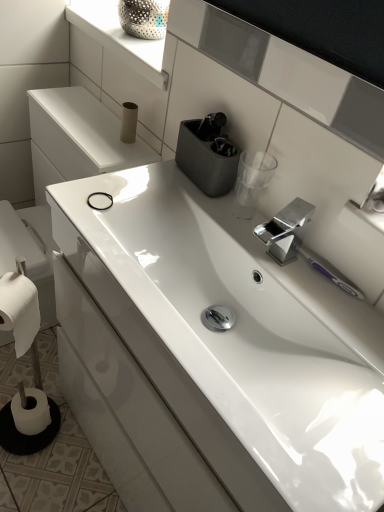
Question: Is matte cardboard toilet paper at upper center, positioned as the second toilet paper in back-to-front order, inside matte gray container at upper center?

Choices:
 (A) no
 (B) yes

Answer: (A)

Question: Is the surface of matte gray container at upper center in direct contact with matte cardboard toilet paper at upper center, the third toilet paper positioned from the bottom?

Choices:
 (A) no
 (B) yes

Answer: (A)

Question: Is matte gray container at upper center closer to camera compared to matte cardboard toilet paper at upper center, the third toilet paper positioned from the bottom?

Choices:
 (A) yes
 (B) no

Answer: (A)

Question: Is matte gray container at upper center further to the viewer compared to matte cardboard toilet paper at upper center, the 3th toilet paper viewed from the left?

Choices:
 (A) yes
 (B) no

Answer: (B)

Question: Is matte gray container at upper center facing towards matte cardboard toilet paper at upper center, the first toilet paper viewed from the right?

Choices:
 (A) no
 (B) yes

Answer: (A)

Question: Is matte gray container at upper center at the right side of matte cardboard toilet paper at upper center, which is the 1th toilet paper in top-to-bottom order?

Choices:
 (A) no
 (B) yes

Answer: (B)

Question: Is matte cardboard toilet paper at upper center, the first toilet paper viewed from the right, facing away from white glossy window sill at upper center?

Choices:
 (A) no
 (B) yes

Answer: (A)

Question: Considering the relative sizes of matte cardboard toilet paper at upper center, the first toilet paper viewed from the right, and white glossy window sill at upper center in the image provided, is matte cardboard toilet paper at upper center, the first toilet paper viewed from the right, wider than white glossy window sill at upper center?

Choices:
 (A) no
 (B) yes

Answer: (A)

Question: From a real-world perspective, is matte cardboard toilet paper at upper center, the 3th toilet paper viewed from the left, physically above white glossy window sill at upper center?

Choices:
 (A) no
 (B) yes

Answer: (A)

Question: Can you confirm if matte cardboard toilet paper at upper center, the 3th toilet paper viewed from the left, is positioned to the right of white glossy window sill at upper center?

Choices:
 (A) no
 (B) yes

Answer: (A)

Question: Is matte cardboard toilet paper at upper center, which appears as the 2th toilet paper when viewed from the front, shorter than white glossy window sill at upper center?

Choices:
 (A) yes
 (B) no

Answer: (B)

Question: From a real-world perspective, is matte cardboard toilet paper at upper center, positioned as the second toilet paper in back-to-front order, below white glossy window sill at upper center?

Choices:
 (A) yes
 (B) no

Answer: (A)

Question: Does white glossy sink at center come in front of polished metallic tap at center?

Choices:
 (A) no
 (B) yes

Answer: (B)